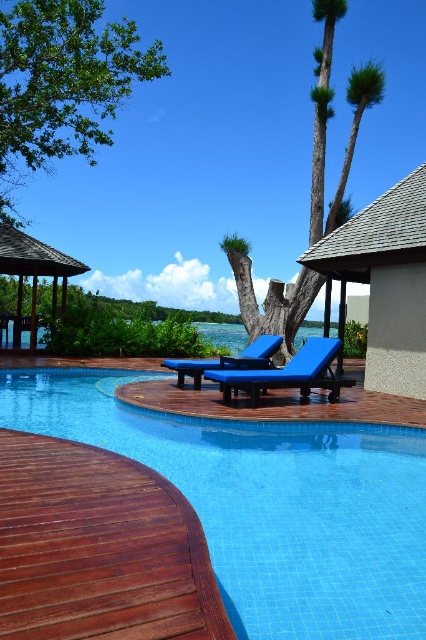
Question: Can you confirm if wooden gazebo at left is positioned to the right of blue fabric lounge chair at center?

Choices:
 (A) yes
 (B) no

Answer: (B)

Question: Which object is positioned closest to the shiny brown wood at lower left?

Choices:
 (A) blue fabric lounge chair at center
 (B) wooden gazebo at left

Answer: (A)

Question: Is shiny brown wood at lower left in front of green leafy tree at upper left?

Choices:
 (A) yes
 (B) no

Answer: (A)

Question: Which of the following is the farthest from the observer?

Choices:
 (A) blue tile swimming pool at center
 (B) green leafy tree at upper left

Answer: (B)

Question: Which object appears farthest from the camera in this image?

Choices:
 (A) blue tile swimming pool at center
 (B) blue fabric lounge chair at center
 (C) green leafy palm tree at center
 (D) wooden gazebo at left

Answer: (D)

Question: Is blue tile swimming pool at center behind blue fabric chaise lounge at center?

Choices:
 (A) no
 (B) yes

Answer: (A)